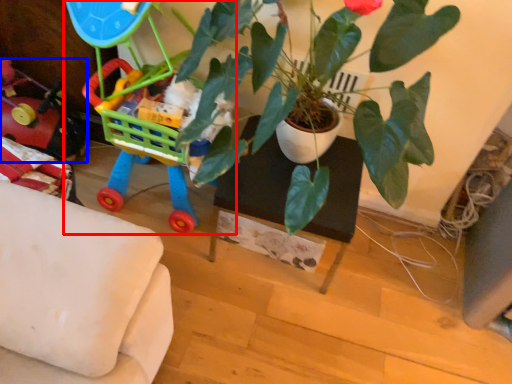
Question: Which point is further to the camera, toy (highlighted by a red box) or toy (highlighted by a blue box)?

Choices:
 (A) toy
 (B) toy

Answer: (B)